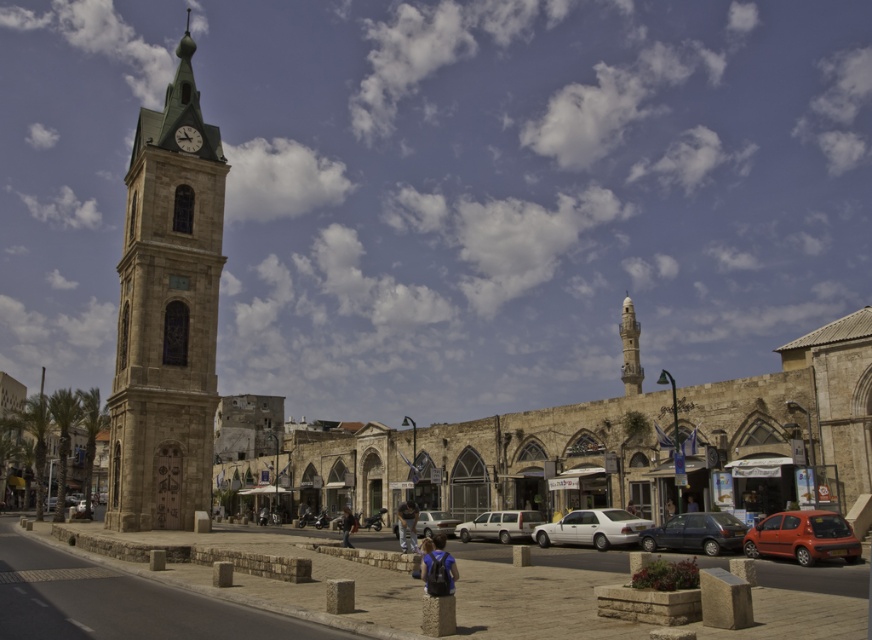
Question: Which point is closer to the camera?

Choices:
 (A) (447, 560)
 (B) (185, 140)
 (C) (576, 509)
 (D) (506, 531)

Answer: (A)

Question: Among these points, which one is nearest to the camera?

Choices:
 (A) (437, 563)
 (B) (833, 532)

Answer: (A)

Question: In this image, where is stone clock tower at left located relative to stone minaret at center?

Choices:
 (A) left
 (B) right

Answer: (A)

Question: Which is nearer to the silver metallic sedan at center?

Choices:
 (A) silver metallic van at center
 (B) blue backpack at center
 (C) matte black car at lower right
 (D) dark blue jeans at lower center

Answer: (A)

Question: Does silver metallic sedan at center have a smaller size compared to dark blue fabric jacket at center?

Choices:
 (A) no
 (B) yes

Answer: (A)

Question: Does silver metallic van at center have a larger size compared to denim pants at center?

Choices:
 (A) no
 (B) yes

Answer: (A)